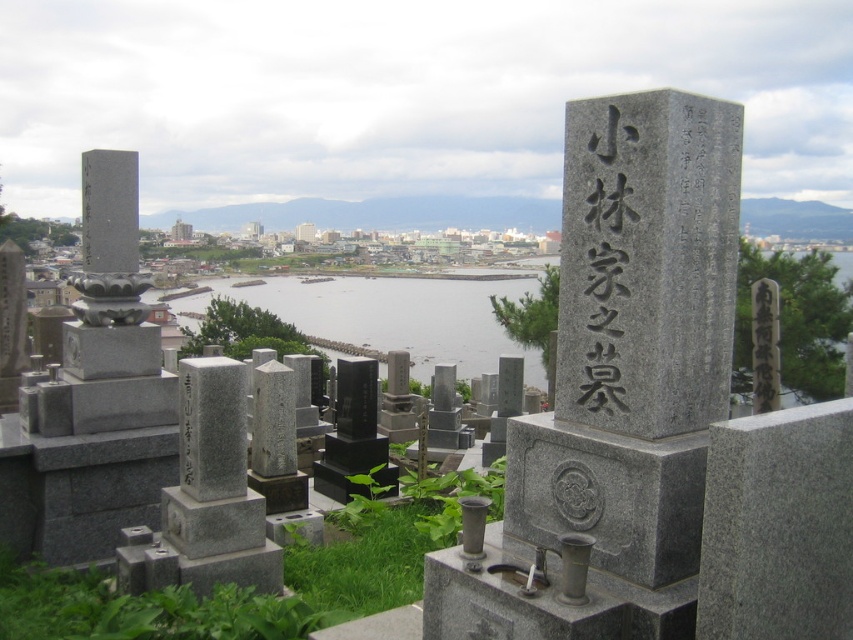
Question: Which object appears farthest from the camera in this image?

Choices:
 (A) clear water at center
 (B) black stone marker at center
 (C) gray stone monument at center
 (D) black stone inscription at center

Answer: (A)

Question: Which point is farther from the camera taking this photo?

Choices:
 (A) (416, 301)
 (B) (625, 442)

Answer: (A)

Question: From the image, what is the correct spatial relationship of black stone inscription at center in relation to black stone marker at center?

Choices:
 (A) below
 (B) above

Answer: (B)

Question: Is black stone inscription at center in front of black stone marker at center?

Choices:
 (A) no
 (B) yes

Answer: (B)

Question: Among these points, which one is nearest to the camera?

Choices:
 (A) (579, 392)
 (B) (189, 387)
 (C) (450, 328)

Answer: (A)

Question: Can you confirm if gray stone monument at center is smaller than black stone marker at center?

Choices:
 (A) no
 (B) yes

Answer: (A)